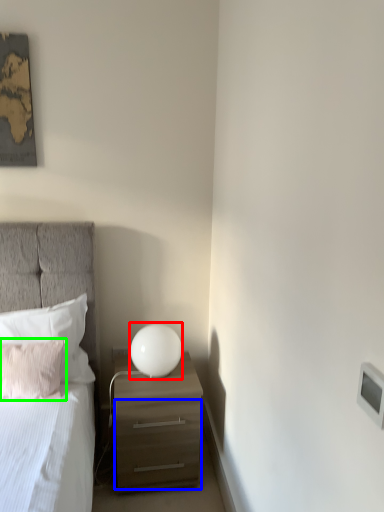
Question: Considering the real-world distances, which object is closest to table lamp (highlighted by a red box)? drawer (highlighted by a blue box) or pillow (highlighted by a green box).

Choices:
 (A) drawer
 (B) pillow

Answer: (A)